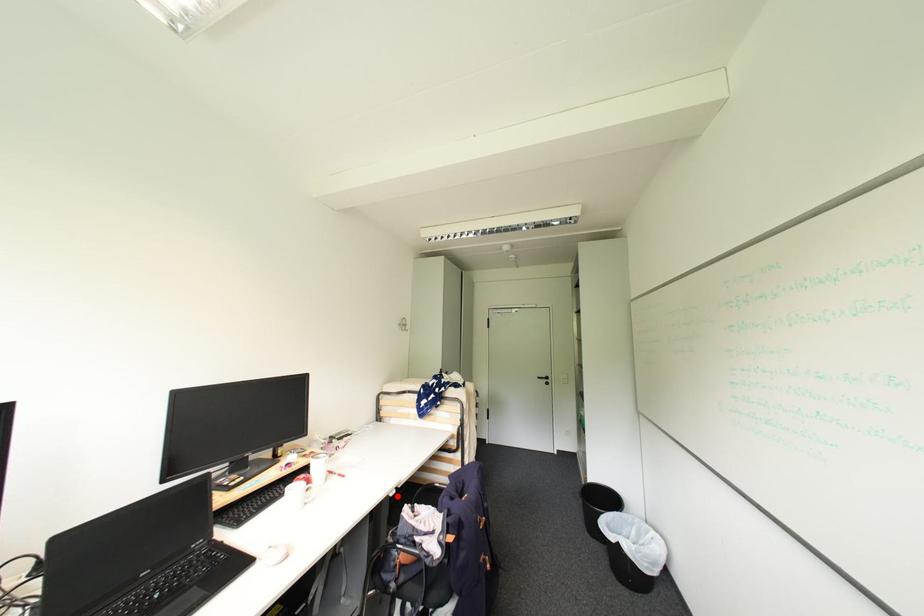
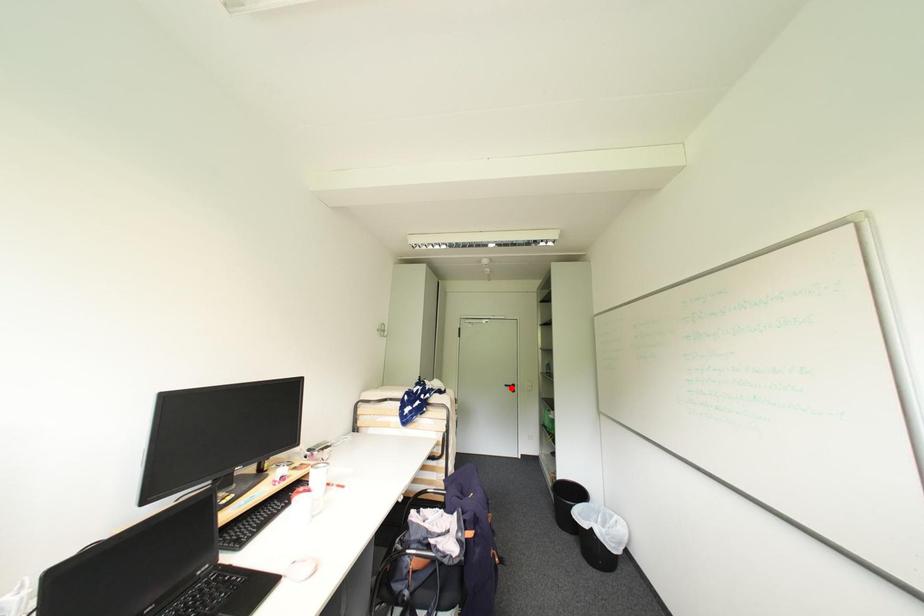
I am providing you with two images of the same scene from different viewpoints. A red point is marked on the first image and another point is marked on the second image. Does the point marked in image1 correspond to the same location as the one in image2?

No